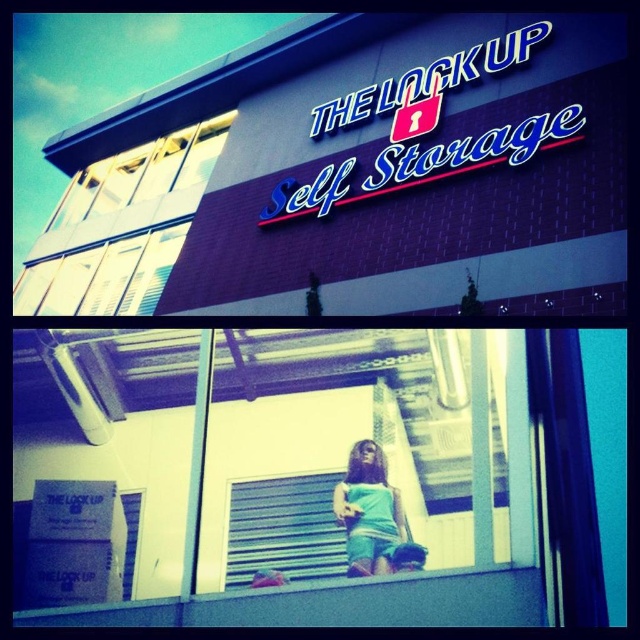
Question: Does transparent glass window at upper left appear on the right side of teal fabric dress at center?

Choices:
 (A) yes
 (B) no

Answer: (B)

Question: Which object is farther from the camera taking this photo?

Choices:
 (A) teal fabric dress at center
 (B) purple brick sign at upper center
 (C) transparent glass window at upper left

Answer: (C)

Question: Does purple brick sign at upper center lie in front of teal fabric dress at center?

Choices:
 (A) yes
 (B) no

Answer: (B)

Question: Can you confirm if purple brick sign at upper center is wider than teal fabric dress at center?

Choices:
 (A) no
 (B) yes

Answer: (B)

Question: Which point appears farthest from the camera in this image?

Choices:
 (A) (93, 237)
 (B) (104, 166)
 (C) (385, 490)

Answer: (B)

Question: Considering the real-world distances, which object is farthest from the purple brick sign at upper center?

Choices:
 (A) transparent glass window at upper left
 (B) teal fabric dress at center

Answer: (B)